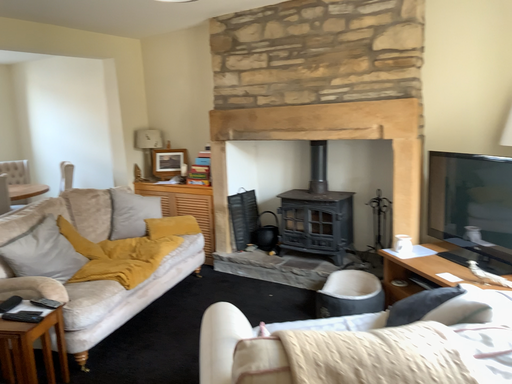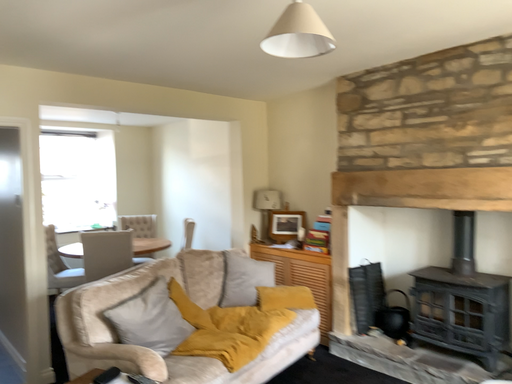
Question: Which way did the camera rotate in the video?

Choices:
 (A) rotated downward
 (B) rotated upward

Answer: (B)